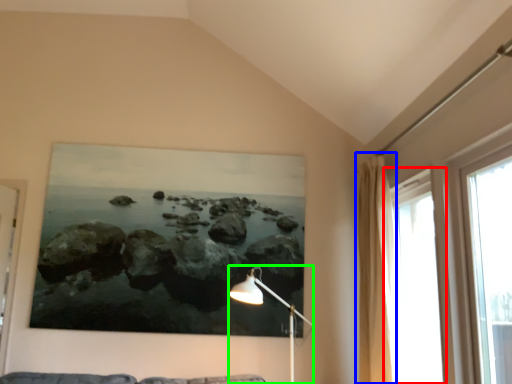
Question: Which object is positioned closest to window (highlighted by a red box)? Select from curtain (highlighted by a blue box) and table lamp (highlighted by a green box).

Choices:
 (A) curtain
 (B) table lamp

Answer: (A)